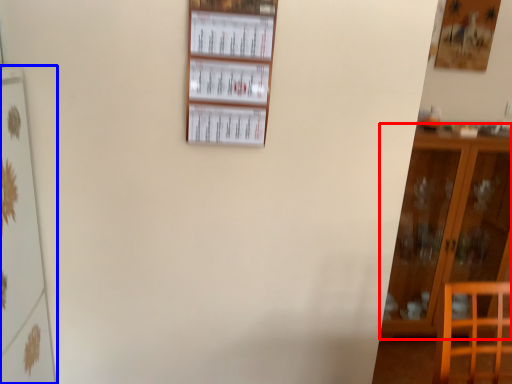
Question: Which point is closer to the camera, furniture (highlighted by a red box) or shelf (highlighted by a blue box)?

Choices:
 (A) furniture
 (B) shelf

Answer: (B)